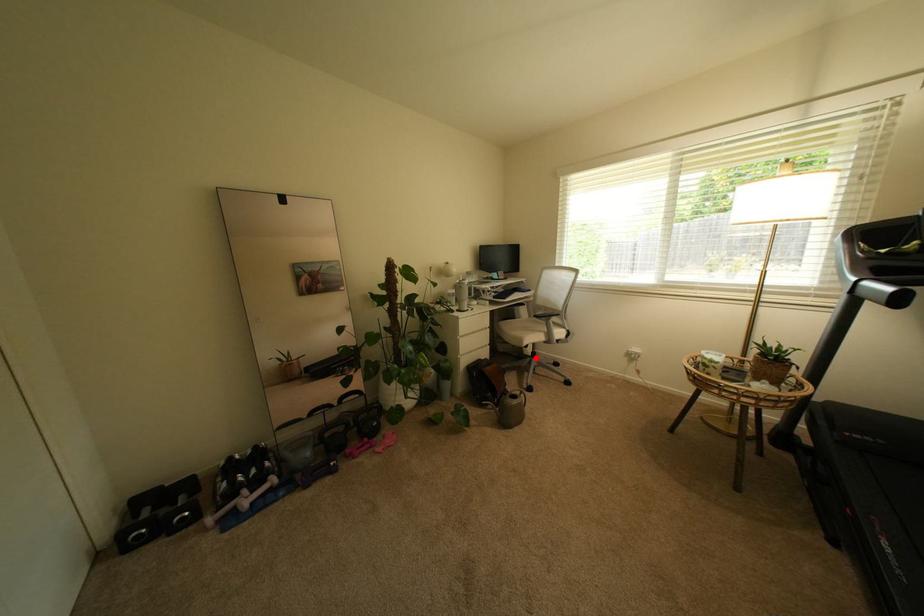
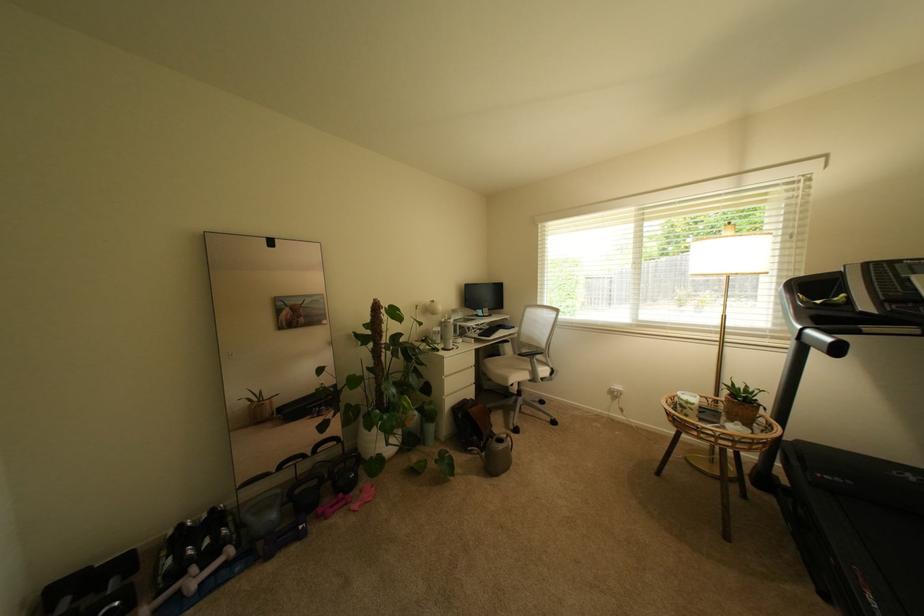
Question: A red point is marked in image1. In image2, is the corresponding 3D point closer to the camera or farther? Reply with the corresponding letter.

Choices:
 (A) The corresponding 3D point is closer.
 (B) The corresponding 3D point is farther.

Answer: (B)